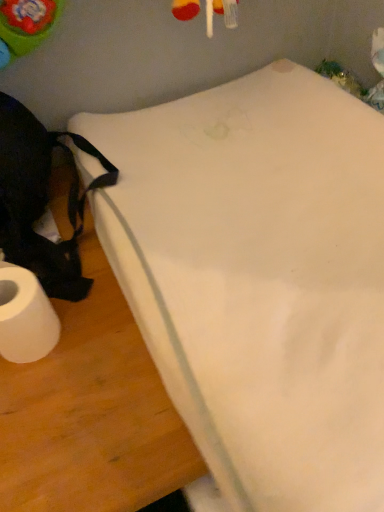
Question: Considering their positions, is white matte toilet paper at lower left located in front of or behind white foam mattress at lower left?

Choices:
 (A) behind
 (B) front

Answer: (A)

Question: Considering the positions of white matte toilet paper at lower left and white foam mattress at lower left in the image, is white matte toilet paper at lower left wider or thinner than white foam mattress at lower left?

Choices:
 (A) thin
 (B) wide

Answer: (A)

Question: From a real-world perspective, is white matte toilet paper at lower left above or below white foam mattress at lower left?

Choices:
 (A) below
 (B) above

Answer: (A)

Question: Considering the relative positions of white foam mattress at lower left and white matte toilet paper at lower left in the image provided, is white foam mattress at lower left to the left or to the right of white matte toilet paper at lower left?

Choices:
 (A) right
 (B) left

Answer: (A)

Question: Does point (331, 432) appear closer or farther from the camera than point (28, 322)?

Choices:
 (A) closer
 (B) farther

Answer: (A)

Question: Based on their sizes in the image, would you say white foam mattress at lower left is bigger or smaller than white matte toilet paper at lower left?

Choices:
 (A) big
 (B) small

Answer: (A)

Question: Is white foam mattress at lower left wider or thinner than white matte toilet paper at lower left?

Choices:
 (A) thin
 (B) wide

Answer: (B)